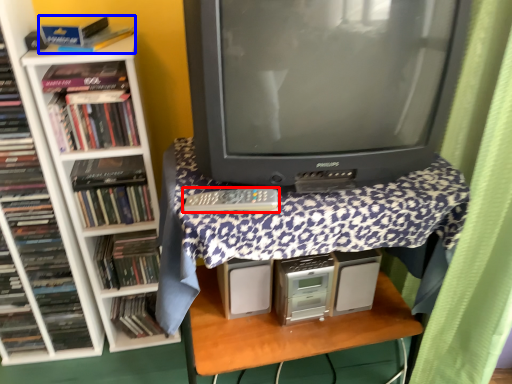
Question: Which point is closer to the camera, remote (highlighted by a red box) or book (highlighted by a blue box)?

Choices:
 (A) remote
 (B) book

Answer: (A)